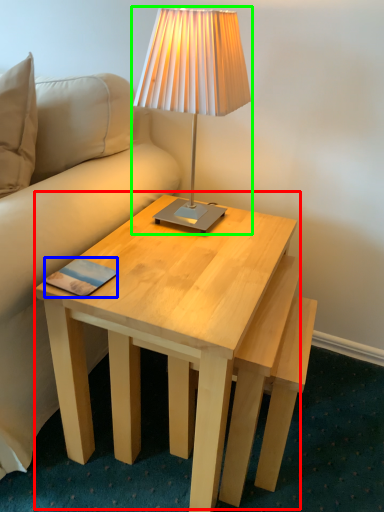
Question: Based on their relative distances, which object is farther from coffee table (highlighted by a red box)? Choose from pad (highlighted by a blue box) and lamp (highlighted by a green box).

Choices:
 (A) pad
 (B) lamp

Answer: (B)